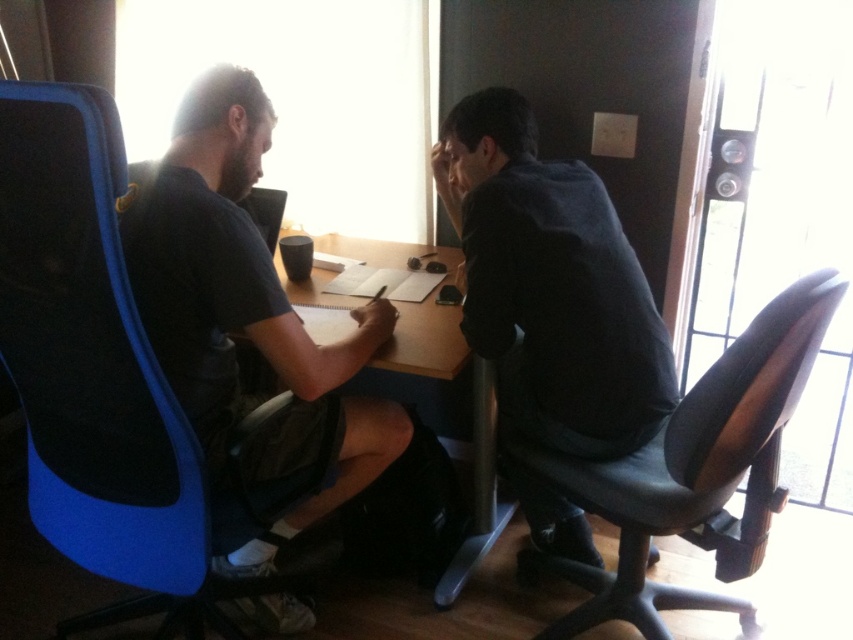
Does blue fabric chair at left appear on the left side of wooden table at center?

Yes, blue fabric chair at left is to the left of wooden table at center.

Is point (15, 166) less distant than point (434, 348)?

Yes, point (15, 166) is in front of point (434, 348).

Between point (102, 220) and point (480, 476), which one is positioned behind?

The point (480, 476) is behind.

Find the location of `blue fabric chair at left`. blue fabric chair at left is located at coordinates (91, 362).

Is point (334, 348) positioned in front of point (440, 248)?

Yes, point (334, 348) is in front of point (440, 248).

Does matte black t-shirt at left have a lesser height compared to wooden table at center?

No.

I want to click on matte black t-shirt at left, so click(228, 278).

The height and width of the screenshot is (640, 853). I want to click on matte black t-shirt at left, so click(228, 278).

Is dark gray shirt at right taller than wooden table at center?

Indeed, dark gray shirt at right has a greater height compared to wooden table at center.

Does dark gray shirt at right have a smaller size compared to wooden table at center?

Correct, dark gray shirt at right occupies less space than wooden table at center.

Is point (575, 452) positioned behind point (328, 324)?

That is False.

The height and width of the screenshot is (640, 853). Identify the location of dark gray shirt at right. (550, 285).